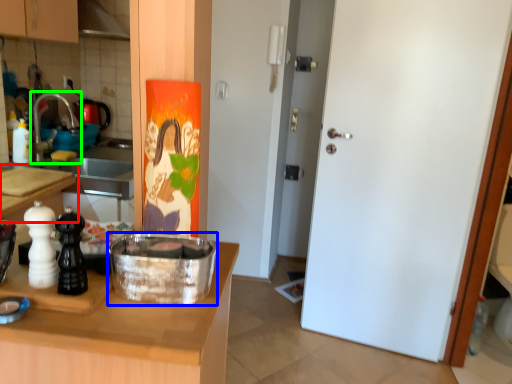
Question: Estimate the real-world distances between objects in this image. Which object is farther from countertop (highlighted by a red box), kitchen appliance (highlighted by a blue box) or faucet (highlighted by a green box)?

Choices:
 (A) kitchen appliance
 (B) faucet

Answer: (A)